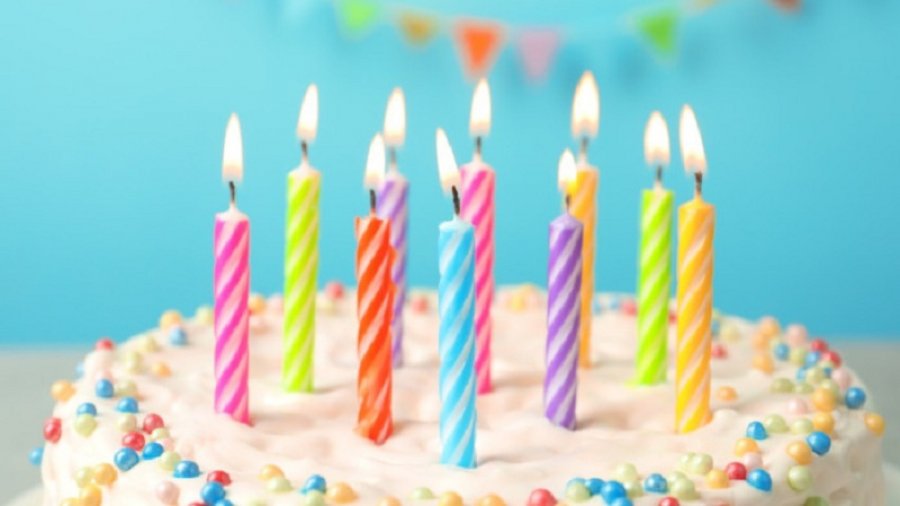
Locate an element on the screen. This screenshot has height=506, width=900. birthday candle wicks is located at coordinates (232, 192), (303, 150), (372, 198), (391, 155), (455, 196), (478, 144), (567, 201), (585, 145), (658, 172), (697, 181).